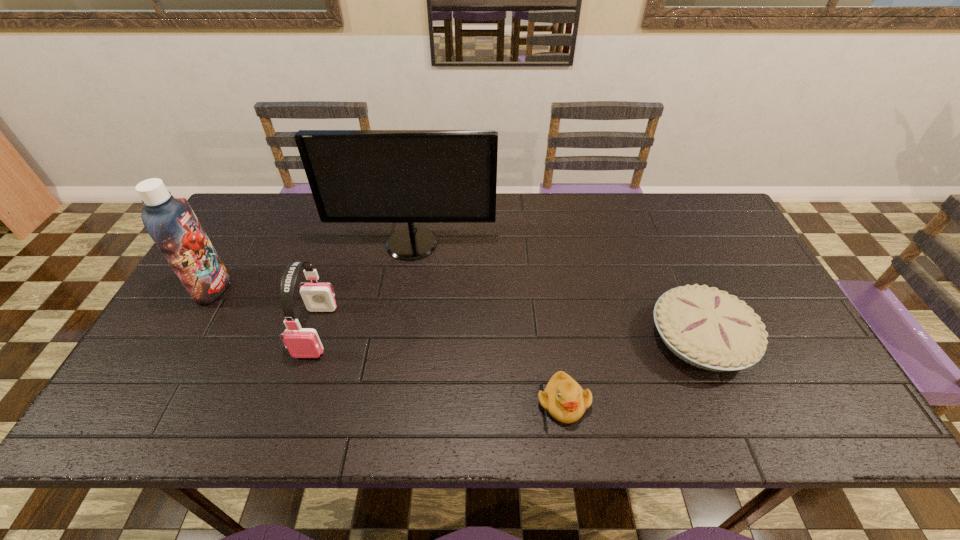
Where is `object that is at the near edge`? The image size is (960, 540). object that is at the near edge is located at coordinates (563, 397).

I want to click on object that is at the left edge, so click(171, 223).

Where is `object positioned at the right edge`? object positioned at the right edge is located at coordinates (705, 327).

The image size is (960, 540). What are the coordinates of `vacant region at the far edge` in the screenshot? It's located at 392,230.

Where is `blank space at the near edge of the desktop`? Image resolution: width=960 pixels, height=540 pixels. blank space at the near edge of the desktop is located at coordinates (375, 425).

Identify the location of free space at the right edge of the desktop. Image resolution: width=960 pixels, height=540 pixels. pyautogui.click(x=812, y=370).

At what (x,y) coordinates should I click in order to perform the action: click on vacant point at the far left corner. Please return your answer as a coordinate pair (x, y). This screenshot has width=960, height=540. Looking at the image, I should click on (255, 216).

I want to click on free space between the farthest object and the duckling, so click(488, 323).

Find the location of a particular element. free space between the computer monitor and the earphone is located at coordinates (364, 287).

You are a GUI agent. You are given a task and a screenshot of the screen. Output one action in this format:
    pyautogui.click(x=<x>, y=<y>)
    Task: Click on the free space between the earphone and the farthest object
    The image size is (960, 540).
    Given the screenshot: What is the action you would take?
    pyautogui.click(x=364, y=287)